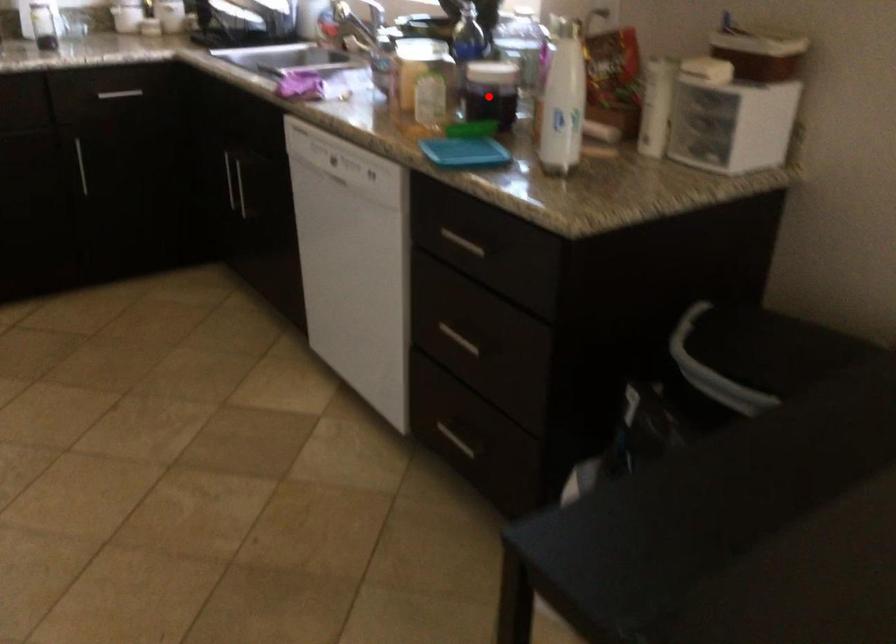
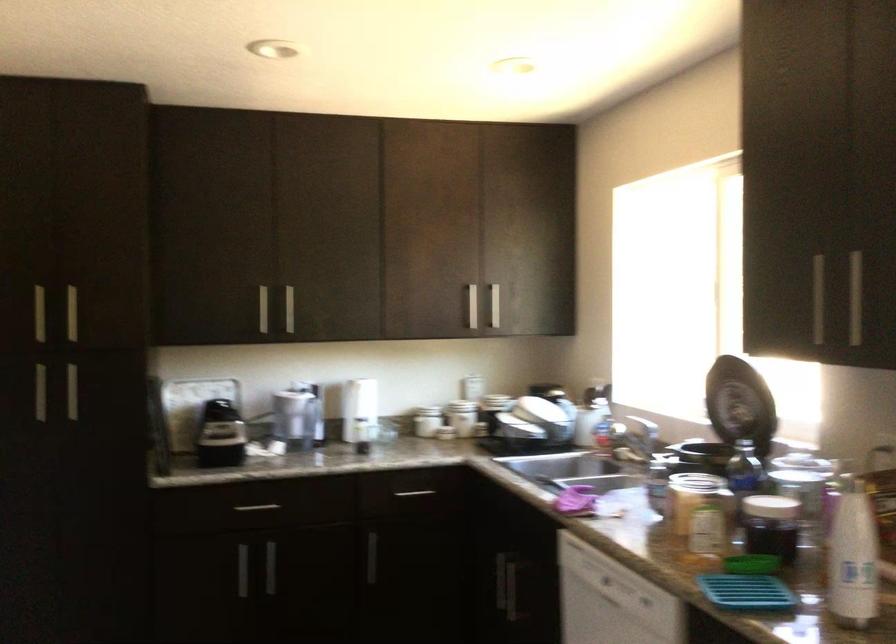
In the second image, find the point that corresponds to the highlighted location in the first image.

(771, 526)